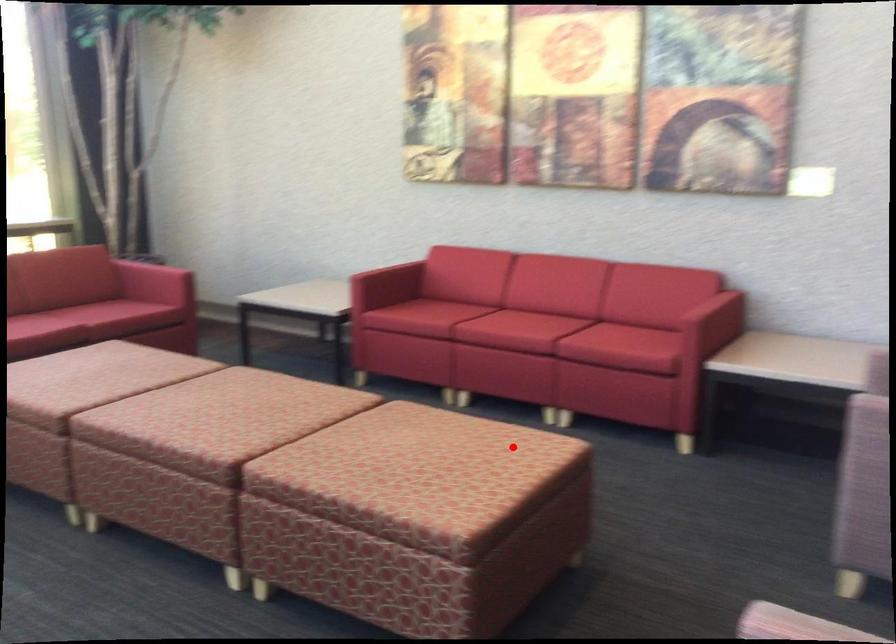
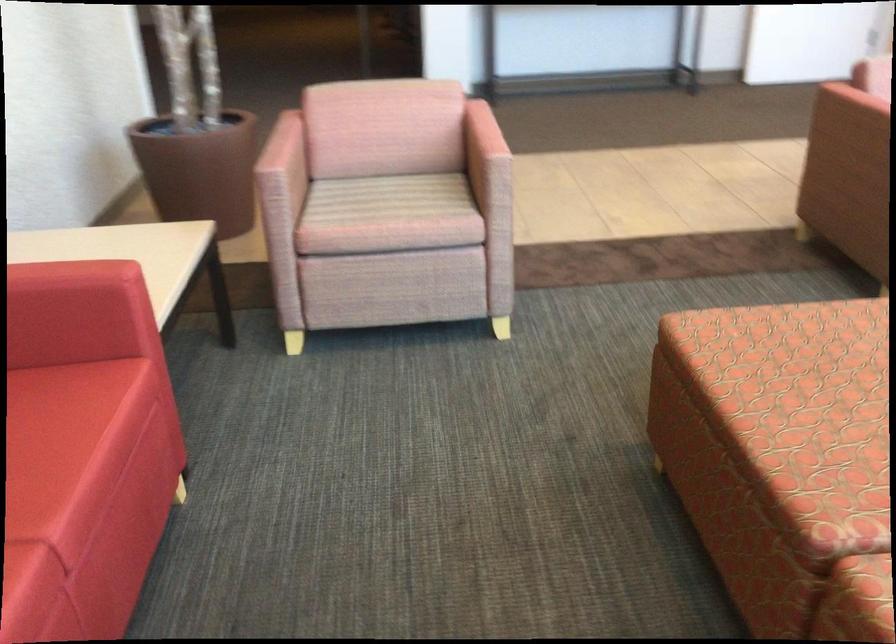
Question: I am providing you with two images of the same scene from different viewpoints. Image1 has a red point marked. In image2, the corresponding 3D location appears at what relative position? Reply with the corresponding letter.

Choices:
 (A) Closer
 (B) Farther

Answer: (A)